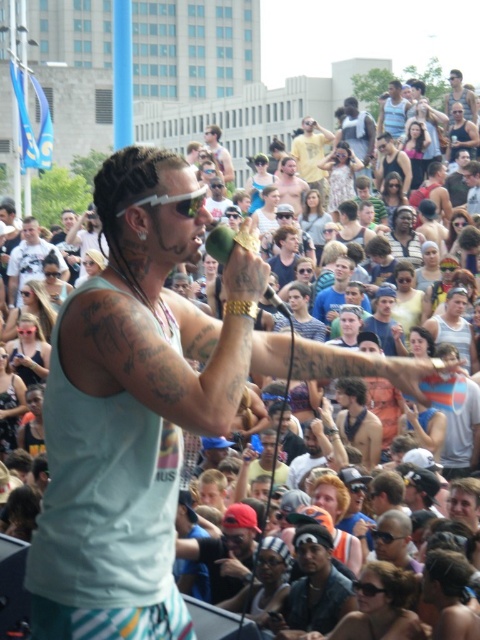
You are a photographer at the concert. You want to capture a photo that includes both the black leather cap at center and the matte black phone at center. Based on their positions, which object should you focus on first to ensure both are in frame?

The black leather cap at center is below matte black phone at center, so you should focus on the matte black phone at center first to ensure both are in frame.

You are a photographer at the concert and want to capture both the black leather cap at center and the matte black phone at center in the same frame. Since both are at the center, which one will appear bigger in the photo?

The black leather cap at center will appear bigger in the photo because it has a larger size compared to the matte black phone at center.